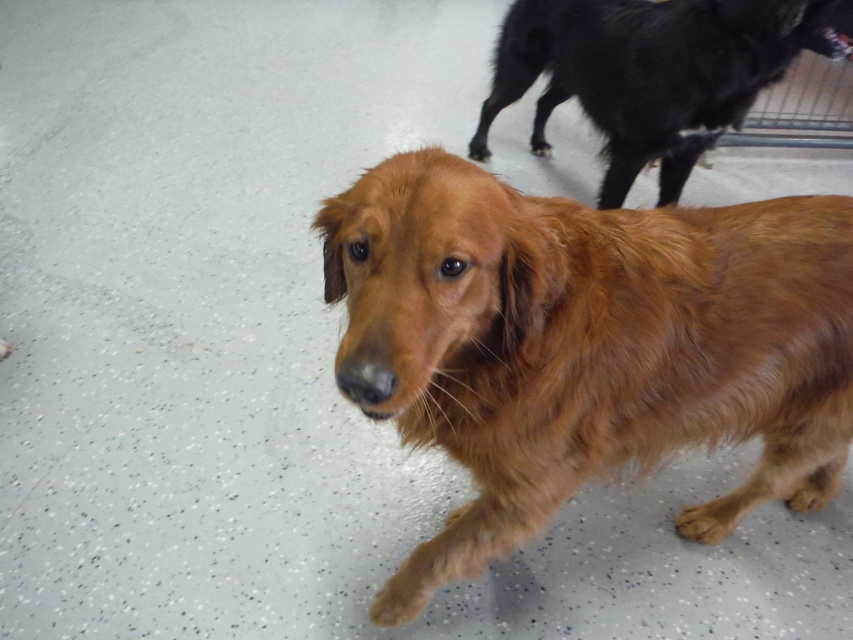
Does shiny golden fur dog at center have a greater height compared to shiny black dog at upper right?

Yes.

Between shiny golden fur dog at center and shiny black dog at upper right, which one is positioned higher?

shiny black dog at upper right

Between point (682, 365) and point (503, 90), which one is positioned behind?

The point (503, 90) is behind.

The image size is (853, 640). Identify the location of shiny golden fur dog at center. (585, 346).